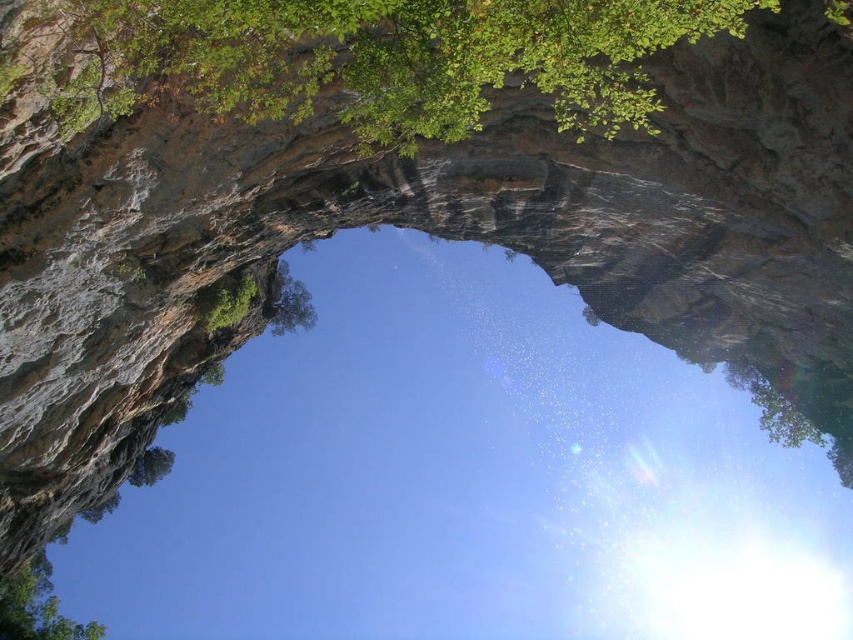
Is green leafy tree at upper center wider than green leafy tree at lower left?

Yes.

The height and width of the screenshot is (640, 853). What do you see at coordinates (376, 58) in the screenshot?
I see `green leafy tree at upper center` at bounding box center [376, 58].

What are the coordinates of `green leafy tree at upper center` in the screenshot? It's located at (376, 58).

You are a GUI agent. You are given a task and a screenshot of the screen. Output one action in this format:
    pyautogui.click(x=<x>, y=<y>)
    Task: Click on the green leafy tree at upper center
    The image size is (853, 640).
    Given the screenshot: What is the action you would take?
    pyautogui.click(x=376, y=58)

In the scene shown: Does transparent water at center appear over green leafy tree at lower left?

No, transparent water at center is not above green leafy tree at lower left.

Between transparent water at center and green leafy tree at lower left, which one has less height?

green leafy tree at lower left

Where is `transparent water at center`? The image size is (853, 640). transparent water at center is located at coordinates (463, 477).

Does transparent water at center have a lesser width compared to green leafy tree at upper center?

No.

Based on the photo, who is positioned more to the left, transparent water at center or green leafy tree at upper center?

green leafy tree at upper center

Who is more distant from viewer, (410, 513) or (379, 74)?

The point (410, 513) is behind.

This screenshot has height=640, width=853. In order to click on transparent water at center in this screenshot , I will do `click(463, 477)`.